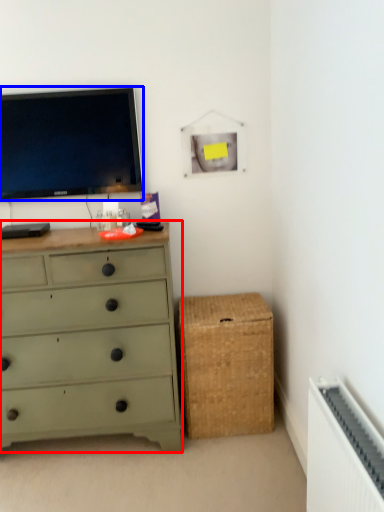
Question: Which object is further to the camera taking this photo, chest of drawers (highlighted by a red box) or television (highlighted by a blue box)?

Choices:
 (A) chest of drawers
 (B) television

Answer: (B)